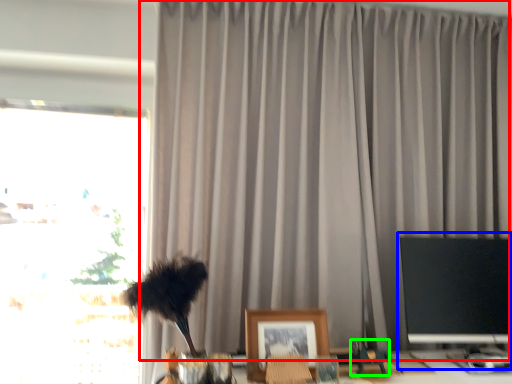
Question: Which object is positioned farthest from curtain (highlighted by a red box)? Select from computer monitor (highlighted by a blue box) and toy (highlighted by a green box).

Choices:
 (A) computer monitor
 (B) toy

Answer: (B)